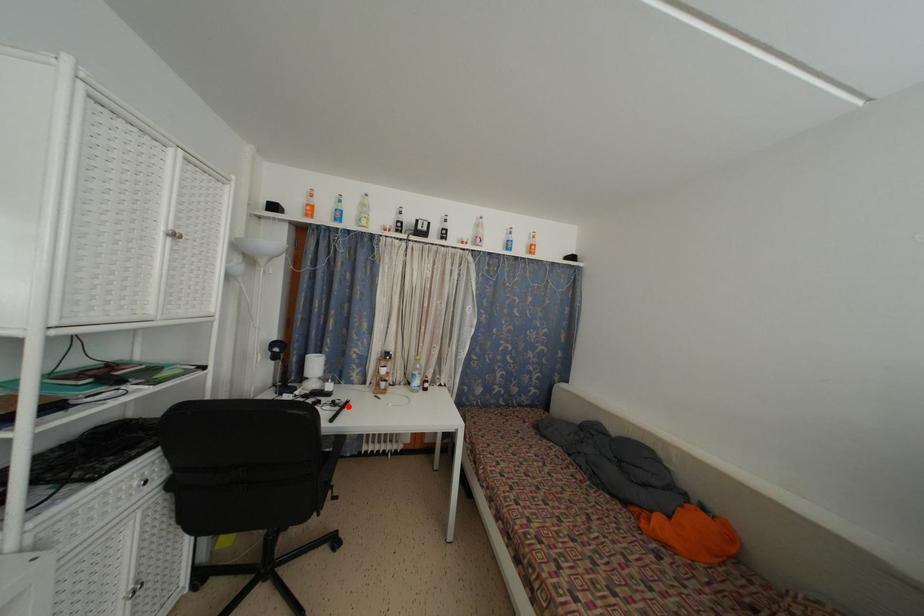
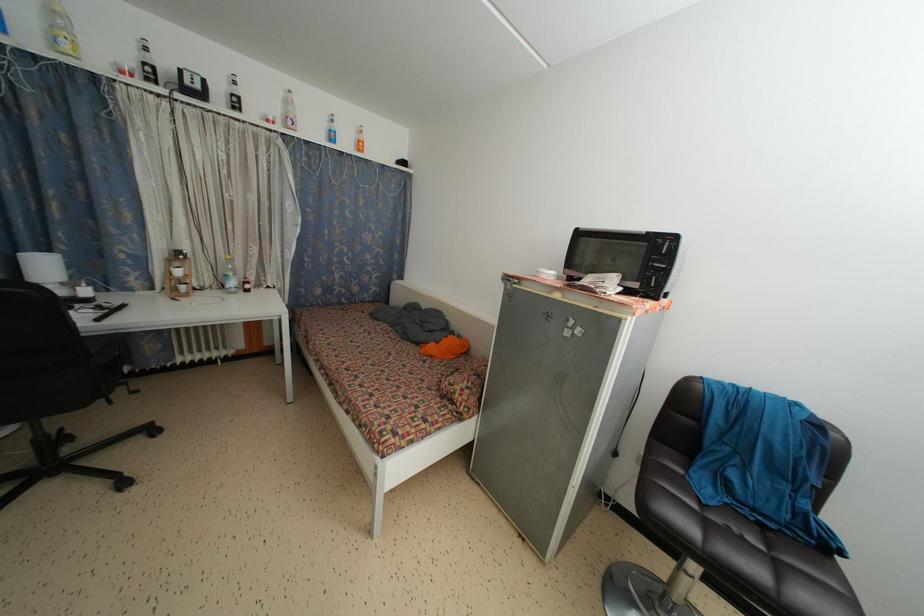
Where in the second image is the point corresponding to the highlighted location from the first image?

(122, 310)